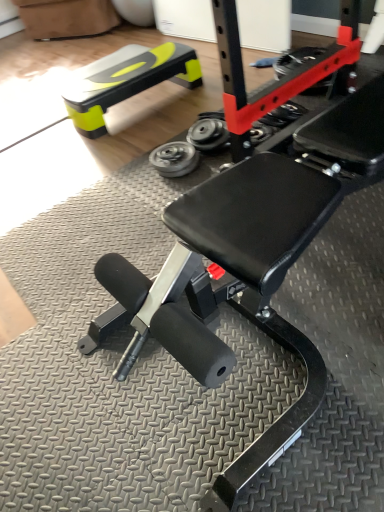
Question: Which direction should I rotate to look at metallic gray wheel at center, the 1th wheel positioned from the right?

Choices:
 (A) right
 (B) left

Answer: (A)

Question: Considering the relative positions of rubber/soft tire at center and neon yellow plastic bench at upper left in the image provided, is rubber/soft tire at center in front of neon yellow plastic bench at upper left?

Choices:
 (A) yes
 (B) no

Answer: (A)

Question: Is rubber/soft tire at center next to neon yellow plastic bench at upper left?

Choices:
 (A) no
 (B) yes

Answer: (A)

Question: Is rubber/soft tire at center smaller than neon yellow plastic bench at upper left?

Choices:
 (A) yes
 (B) no

Answer: (A)

Question: Considering the relative sizes of rubber/soft tire at center and neon yellow plastic bench at upper left in the image provided, is rubber/soft tire at center thinner than neon yellow plastic bench at upper left?

Choices:
 (A) yes
 (B) no

Answer: (A)

Question: Can you confirm if rubber/soft tire at center is wider than neon yellow plastic bench at upper left?

Choices:
 (A) yes
 (B) no

Answer: (B)

Question: Is rubber/soft tire at center completely or partially outside of neon yellow plastic bench at upper left?

Choices:
 (A) yes
 (B) no

Answer: (A)

Question: Can you confirm if rubber/soft tire at center is thinner than metallic gray wheel at center, the 1th wheel positioned from the right?

Choices:
 (A) no
 (B) yes

Answer: (A)

Question: Is rubber/soft tire at center aimed at metallic gray wheel at center, the 1th wheel positioned from the right?

Choices:
 (A) yes
 (B) no

Answer: (A)

Question: Does rubber/soft tire at center have a greater height compared to metallic gray wheel at center, the 2th wheel viewed from the left?

Choices:
 (A) yes
 (B) no

Answer: (A)

Question: Is rubber/soft tire at center bigger than metallic gray wheel at center, the 2th wheel viewed from the left?

Choices:
 (A) no
 (B) yes

Answer: (B)

Question: Is rubber/soft tire at center to the left of metallic gray wheel at center, the 2th wheel viewed from the left, from the viewer's perspective?

Choices:
 (A) yes
 (B) no

Answer: (B)

Question: From the image's perspective, is rubber/soft tire at center on metallic gray wheel at center, the 1th wheel positioned from the right?

Choices:
 (A) yes
 (B) no

Answer: (A)

Question: Is metallic silver wheel at center, placed as the first wheel when sorted from left to right, positioned before rubber/soft tire at center?

Choices:
 (A) yes
 (B) no

Answer: (A)